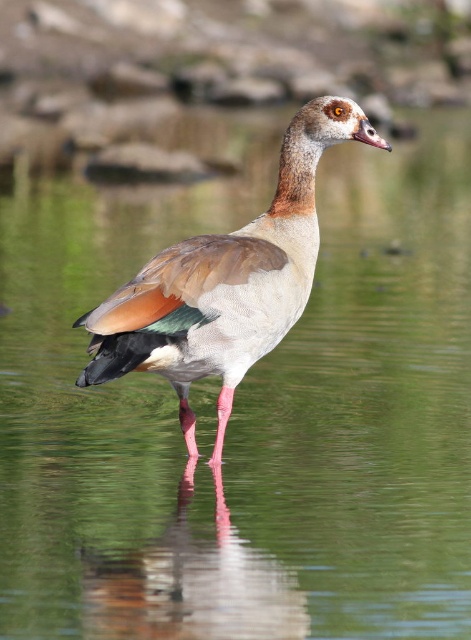
You are a wildlife photographer aiming to capture the brown feathered goose at center and the glossy water at center in a single frame. Considering the size of the goose compared to the water, which object should you focus on first to ensure both are in focus?

The brown feathered goose at center is bigger than the glossy water at center, so you should focus on the brown feathered goose at center first to ensure both are in focus.

You are a photographer trying to capture the bird in the image. You notice two points marked in the scene. The first point is at coordinates point (305, 164), and the second is at point (135, 572). Which point is closer to your camera lens?

Point (305, 164) is further to the viewer than point (135, 572), so the second point is closer to the camera lens.